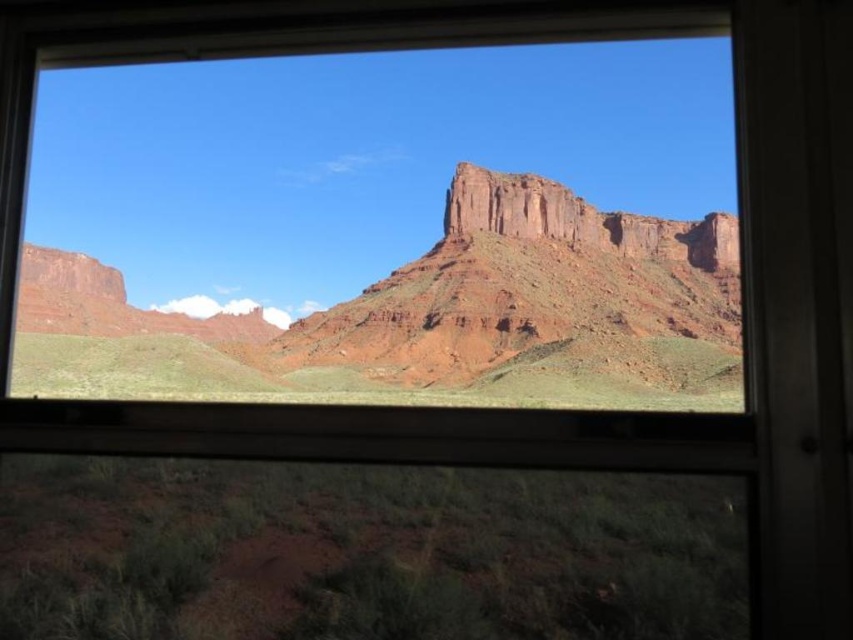
Question: Does rustic sandstone mountain at center appear under rustic sandstone cliff at center?

Choices:
 (A) yes
 (B) no

Answer: (A)

Question: Is rustic sandstone mountain at center to the left of rustic sandstone cliff at center from the viewer's perspective?

Choices:
 (A) no
 (B) yes

Answer: (B)

Question: Which object is farther from the camera taking this photo?

Choices:
 (A) rustic sandstone mountain at center
 (B) rustic sandstone cliff at center

Answer: (B)

Question: Which point is farther to the camera?

Choices:
 (A) rustic sandstone mountain at center
 (B) rustic sandstone cliff at center

Answer: (B)

Question: Which point appears closest to the camera in this image?

Choices:
 (A) (74, 337)
 (B) (683, 241)

Answer: (A)

Question: Can you confirm if rustic sandstone mountain at center is thinner than rustic sandstone cliff at center?

Choices:
 (A) yes
 (B) no

Answer: (B)